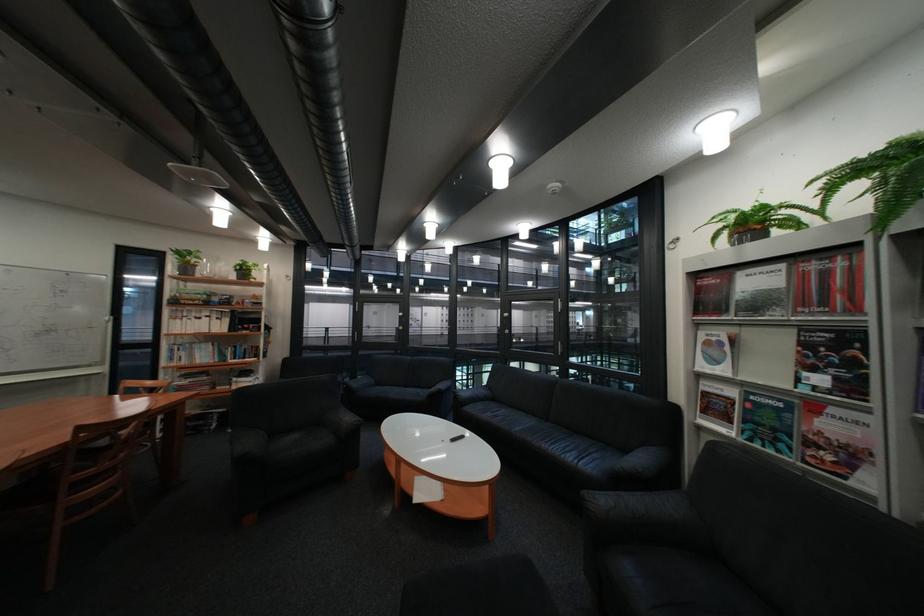
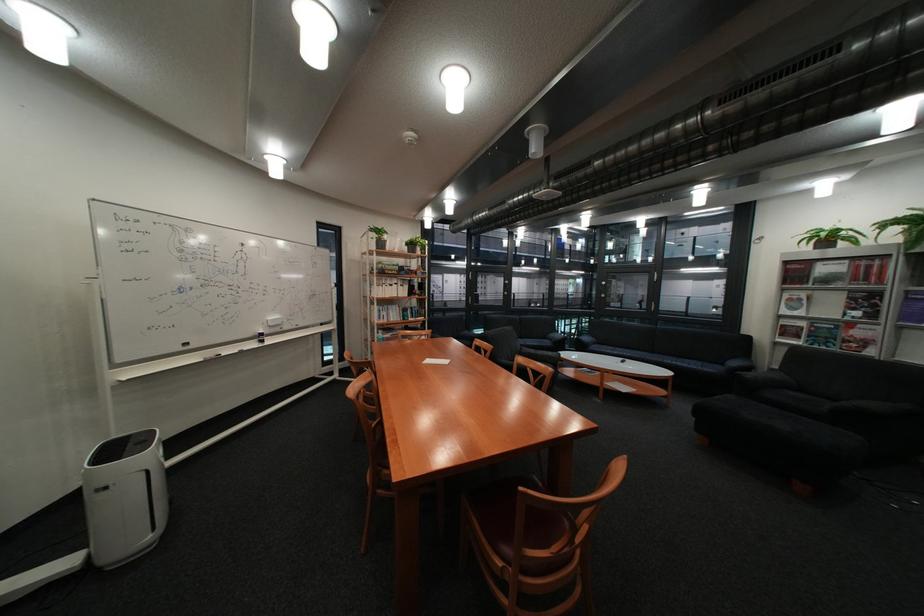
In the second image, find the point that corresponds to [251,270] in the first image.

(421, 245)